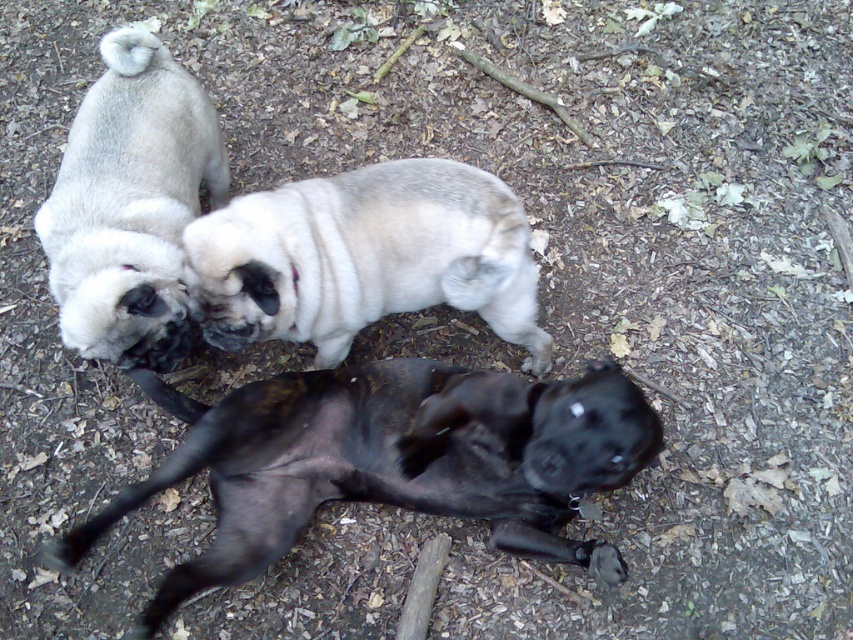
Looking at this image, you are a photographer setting up a camera to capture the fuzzy beige dog at upper center and the matte white pug at upper left. Given their sizes, which dog should you focus on to ensure the photo includes both without cropping either?

The fuzzy beige dog at upper center is wider than the matte white pug at upper left. To include both dogs without cropping, focus on the matte white pug at upper left since it is narrower and will fit within the frame when centered with the wider dog.

You are a photographer positioned at the edge of the park. You want to take a photo that includes both the black smooth dog at center and the matte white pug at upper left. Based on their positions, which dog should you adjust your camera angle to focus on first to ensure both are in frame?

Since the black smooth dog at center is to the right of the matte white pug at upper left, you should first focus on the matte white pug at upper left to ensure both are within the frame.

Based on the photo, you are standing at the point with coordinates point (x=422, y=227) and want to walk to the point with coordinates point (x=451, y=480). Are you walking towards the black dog lying on its back in the foreground?

Yes, you are walking towards the black dog lying on its back in the foreground because point (x=451, y=480) is in front of point (x=422, y=227), meaning it is closer to the observer.